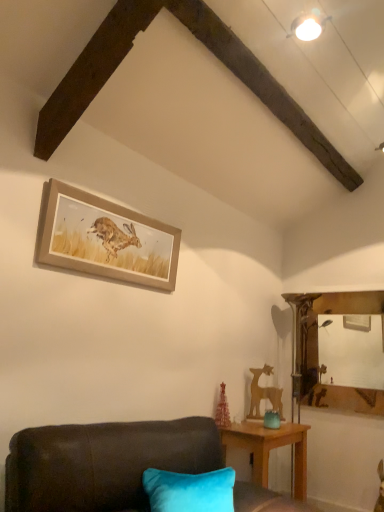
I want to click on wooden deer at right, so click(264, 394).

You are a GUI agent. You are given a task and a screenshot of the screen. Output one action in this format:
    pyautogui.click(x=<x>, y=<y>)
    Task: Click on the teal glass jar at lower right
    
    Given the screenshot: What is the action you would take?
    pyautogui.click(x=272, y=419)

What do you see at coordinates (105, 239) in the screenshot?
I see `wooden framed print of hare at upper center` at bounding box center [105, 239].

This screenshot has width=384, height=512. What do you see at coordinates (269, 449) in the screenshot?
I see `wooden table at lower right` at bounding box center [269, 449].

Where is `wooden deer at right`? wooden deer at right is located at coordinates (x=264, y=394).

Which is more to the right, teal glass jar at lower right or wooden deer at right?

wooden deer at right is more to the right.

You are a GUI agent. You are given a task and a screenshot of the screen. Output one action in this format:
    pyautogui.click(x=<x>, y=<y>)
    Task: Click on the animal above the teal glass jar at lower right (from a real-world perspective)
    This screenshot has height=512, width=384.
    Given the screenshot: What is the action you would take?
    pyautogui.click(x=264, y=394)

Considering the relative sizes of teal glass jar at lower right and wooden deer at right in the image provided, is teal glass jar at lower right taller than wooden deer at right?

No.

Is teal glass jar at lower right next to wooden deer at right?

No, teal glass jar at lower right is not next to wooden deer at right.

Is wooden table at lower right at the back of velvet dark brown couch at lower left?

No, velvet dark brown couch at lower left is not facing away from wooden table at lower right.

Which of these two, velvet dark brown couch at lower left or wooden table at lower right, is bigger?

With larger size is velvet dark brown couch at lower left.

Is velvet dark brown couch at lower left next to wooden table at lower right?

No, velvet dark brown couch at lower left is not beside wooden table at lower right.

Which is more to the left, wooden framed print of hare at upper center or wooden table at lower right?

Positioned to the left is wooden framed print of hare at upper center.

What's the angular difference between wooden framed print of hare at upper center and wooden table at lower right's facing directions?

0.00221 degrees separate the facing orientations of wooden framed print of hare at upper center and wooden table at lower right.

Identify the location of table below the wooden framed print of hare at upper center (from a real-world perspective). (269, 449).

Is there a large distance between wooden framed print of hare at upper center and wooden table at lower right?

Absolutely, wooden framed print of hare at upper center is distant from wooden table at lower right.

From the image's perspective, is teal glass jar at lower right above or below wooden table at lower right?

From the image's perspective, teal glass jar at lower right appears above wooden table at lower right.

Locate an element on the screen. The width and height of the screenshot is (384, 512). table on the left of teal glass jar at lower right is located at coordinates (269, 449).

Does point (275, 418) come closer to viewer compared to point (281, 434)?

No, (275, 418) is behind (281, 434).

Which is correct: teal glass jar at lower right is inside wooden table at lower right, or outside of it?

teal glass jar at lower right is outside wooden table at lower right.

Relative to velvet dark brown couch at lower left, is teal glass jar at lower right in front or behind?

Visually, teal glass jar at lower right is located behind velvet dark brown couch at lower left.

Consider the image. Considering the sizes of objects teal glass jar at lower right and velvet dark brown couch at lower left in the image provided, who is smaller, teal glass jar at lower right or velvet dark brown couch at lower left?

teal glass jar at lower right is smaller.

Which is in front, point (273, 420) or point (219, 435)?

The point (219, 435) is closer.

What are the coordinates of `studio couch on the left side of teal glass jar at lower right` in the screenshot? It's located at (103, 463).

Considering the sizes of velvet dark brown couch at lower left and wooden framed print of hare at upper center in the image, is velvet dark brown couch at lower left taller or shorter than wooden framed print of hare at upper center?

In the image, velvet dark brown couch at lower left appears to be taller than wooden framed print of hare at upper center.

Which is behind, point (92, 511) or point (112, 218)?

The point (112, 218) is farther.

You are a GUI agent. You are given a task and a screenshot of the screen. Output one action in this format:
    pyautogui.click(x=<x>, y=<y>)
    Task: Click on the picture frame behind the velvet dark brown couch at lower left
    This screenshot has height=512, width=384.
    Given the screenshot: What is the action you would take?
    pyautogui.click(x=105, y=239)

Is wooden table at lower right not inside velvet dark brown couch at lower left?

wooden table at lower right lies outside velvet dark brown couch at lower left's area.

Is wooden table at lower right closer to camera compared to velvet dark brown couch at lower left?

That is False.

Who is bigger, wooden table at lower right or velvet dark brown couch at lower left?

With larger size is velvet dark brown couch at lower left.

Is there a large distance between wooden table at lower right and velvet dark brown couch at lower left?

wooden table at lower right is near velvet dark brown couch at lower left, not far away.

At what (x,y) coordinates should I click in order to perform the action: click on teal that appears on the left of wooden deer at right. Please return your answer as a coordinate pair (x, y). Looking at the image, I should click on (272, 419).

You are a GUI agent. You are given a task and a screenshot of the screen. Output one action in this format:
    pyautogui.click(x=<x>, y=<y>)
    Task: Click on the table below the velvet dark brown couch at lower left (from a real-world perspective)
    Image resolution: width=384 pixels, height=512 pixels.
    Given the screenshot: What is the action you would take?
    pyautogui.click(x=269, y=449)

From the image, which object appears to be farther from teal glass jar at lower right, wooden framed print of hare at upper center or wooden deer at right?

Among the two, wooden framed print of hare at upper center is located further to teal glass jar at lower right.

When comparing their distances from wooden deer at right, does teal glass jar at lower right or wooden table at lower right seem closer?

teal glass jar at lower right.

Which object lies nearer to the anchor point teal glass jar at lower right, velvet dark brown couch at lower left or wooden framed print of hare at upper center?

velvet dark brown couch at lower left is closer to teal glass jar at lower right.

Based on their spatial positions, is velvet dark brown couch at lower left or wooden table at lower right further from wooden deer at right?

Based on the image, velvet dark brown couch at lower left appears to be further to wooden deer at right.

Based on their spatial positions, is wooden table at lower right or wooden framed print of hare at upper center closer to velvet dark brown couch at lower left?

wooden table at lower right.

Consider the image. Which object lies nearer to the anchor point velvet dark brown couch at lower left, wooden deer at right or wooden table at lower right?

wooden table at lower right is positioned closer to the anchor velvet dark brown couch at lower left.

Looking at the image, which one is located closer to velvet dark brown couch at lower left, wooden table at lower right or teal glass jar at lower right?

wooden table at lower right is closer to velvet dark brown couch at lower left.

Looking at this image, considering their positions, is teal glass jar at lower right positioned closer to velvet dark brown couch at lower left than wooden table at lower right?

wooden table at lower right is positioned closer to the anchor velvet dark brown couch at lower left.

Find the location of a particular element. Image resolution: width=384 pixels, height=512 pixels. teal between velvet dark brown couch at lower left and wooden deer at right along the z-axis is located at coordinates (272, 419).

Locate an element on the screen. picture frame located between velvet dark brown couch at lower left and teal glass jar at lower right in the depth direction is located at coordinates (105, 239).

The width and height of the screenshot is (384, 512). I want to click on teal that lies between wooden framed print of hare at upper center and wooden table at lower right from top to bottom, so click(272, 419).

Where is `teal positioned between wooden table at lower right and wooden deer at right from near to far`? This screenshot has width=384, height=512. teal positioned between wooden table at lower right and wooden deer at right from near to far is located at coordinates (272, 419).